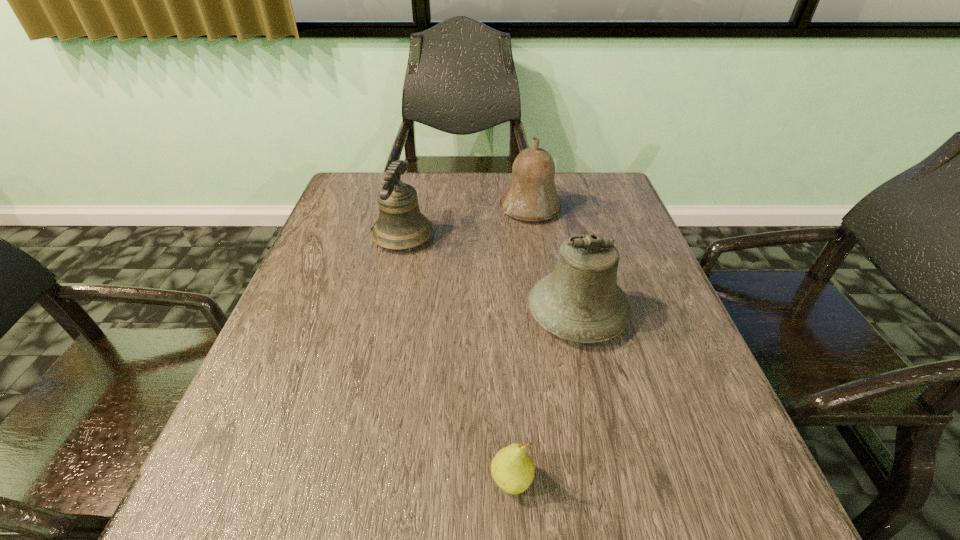
Identify the location of the leftmost bell. (401, 225).

The width and height of the screenshot is (960, 540). I want to click on the second nearest object, so click(580, 301).

Locate an element on the screen. The image size is (960, 540). pear is located at coordinates (512, 469).

The height and width of the screenshot is (540, 960). Identify the location of the nearest object. (512, 469).

What are the coordinates of `blank space located on the front of the leftmost object` in the screenshot? It's located at pos(396,270).

Identify the location of free space located 0.370m on the left of the third farthest object. (352, 313).

This screenshot has height=540, width=960. Identify the location of vacant space located 0.300m on the right of the pear. (732, 482).

Identify the location of object present at the far edge. (531, 195).

Find the location of `object that is at the near edge`. object that is at the near edge is located at coordinates (512, 469).

Identify the location of object present at the left edge. (401, 225).